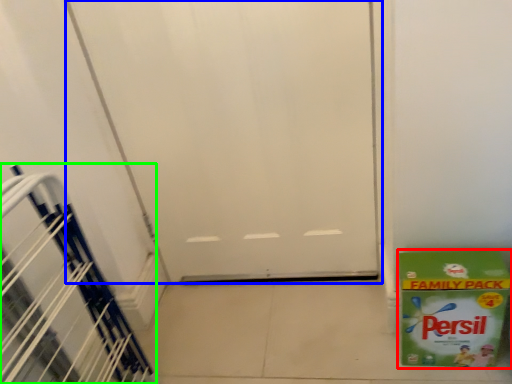
Question: Estimate the real-world distances between objects in this image. Which object is closer to box (highlighted by a red box), door (highlighted by a blue box) or stairwell (highlighted by a green box)?

Choices:
 (A) door
 (B) stairwell

Answer: (A)